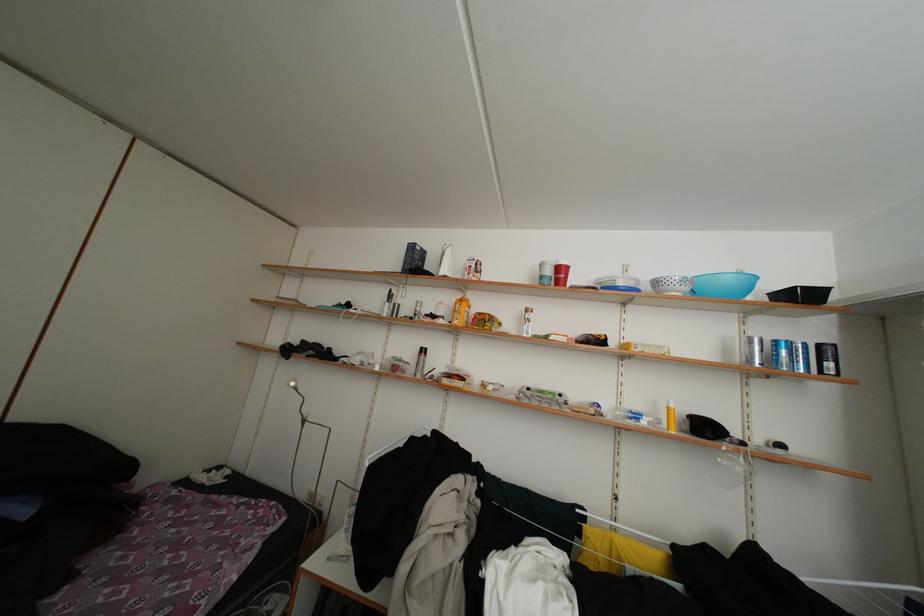
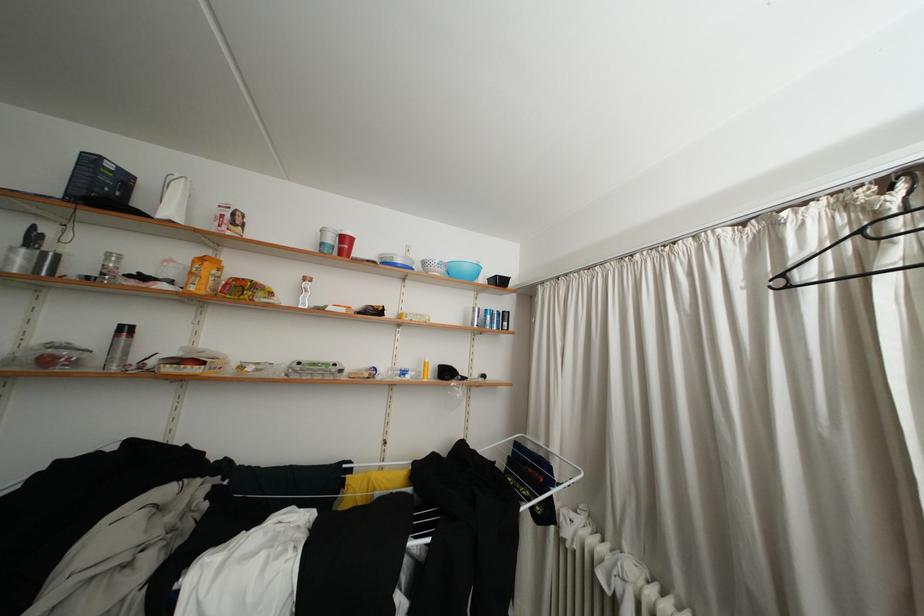
The point at (x=464, y=328) is marked in the first image. Where is the corresponding point in the second image?

(200, 294)